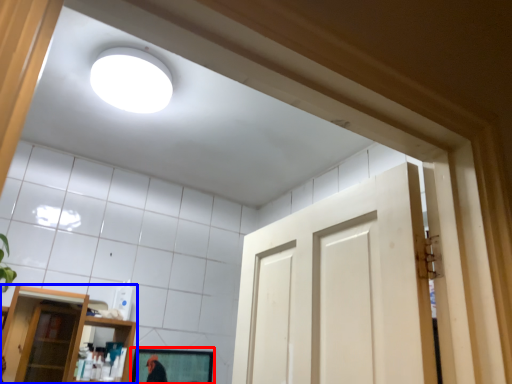
Question: Which object appears farthest to the camera in this image, mirror (highlighted by a red box) or shelf (highlighted by a blue box)?

Choices:
 (A) mirror
 (B) shelf

Answer: (A)